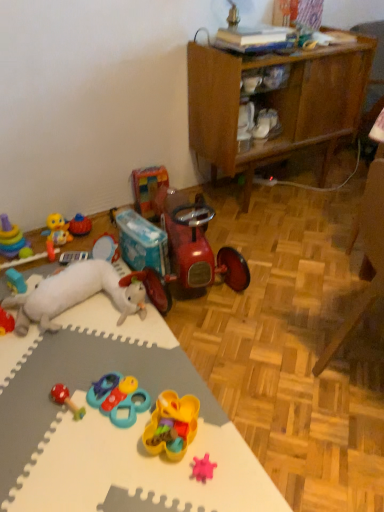
Identify the location of vacant area that lies between rubber duck at center, the 6th toy when ordered from left to right, and teal plastic toy at center, the eighth toy viewed from the left. The height and width of the screenshot is (512, 384). (117, 340).